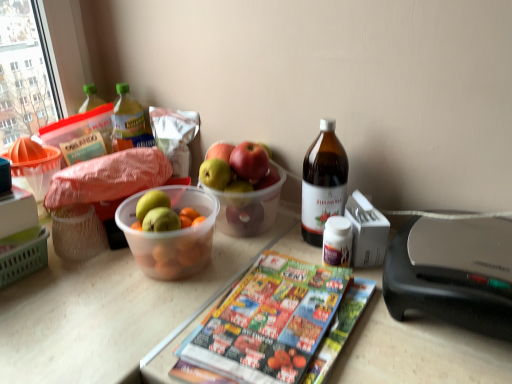
Where is `vacant point above printed paper magazine at center (from a real-world perspective)`? Image resolution: width=512 pixels, height=384 pixels. vacant point above printed paper magazine at center (from a real-world perspective) is located at coordinates (284, 316).